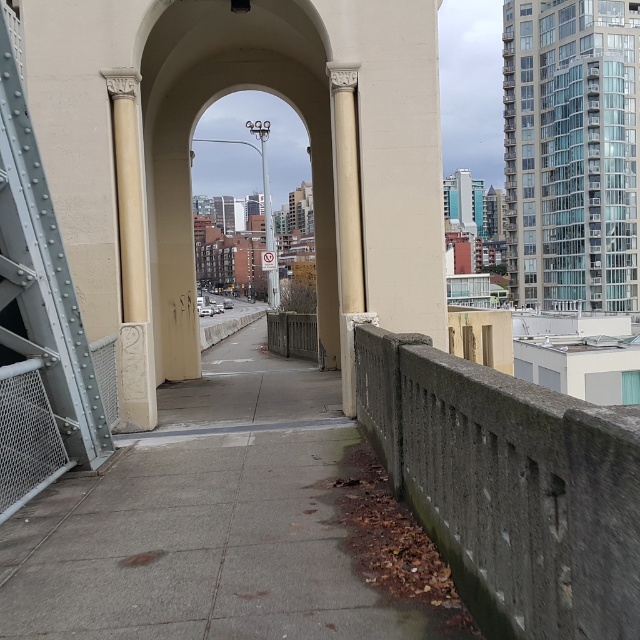
Looking at this image, you are a painter who needs to decide which column to paint first. The white stone column at left and the white marble column at center are both in need of touchup. Which column should you approach first if you are standing at the start of the walkway facing the archway?

The white stone column at left should be approached first because it is smaller than the white marble column at center, making it easier to reach and touch up quickly.

You are a delivery person carrying a heavy box and need to walk along the gray concrete pavement at center. There is a white marble column at center above you. Is the column directly above the pavement, or is it shifted to one side?

The gray concrete pavement at center is below the white marble column at center, so the column is directly above the pavement.

Consider the image. You are standing at the point marked as point (228, 524) in the image. What material is the surface you are currently standing on made of?

The surface at point (228, 524) is gray concrete pavement at center, so the material is concrete.